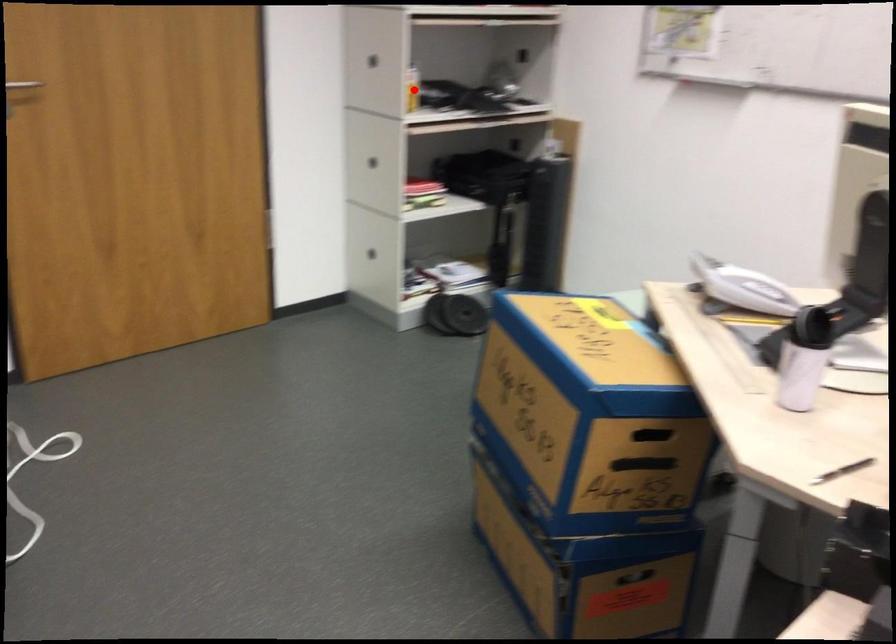
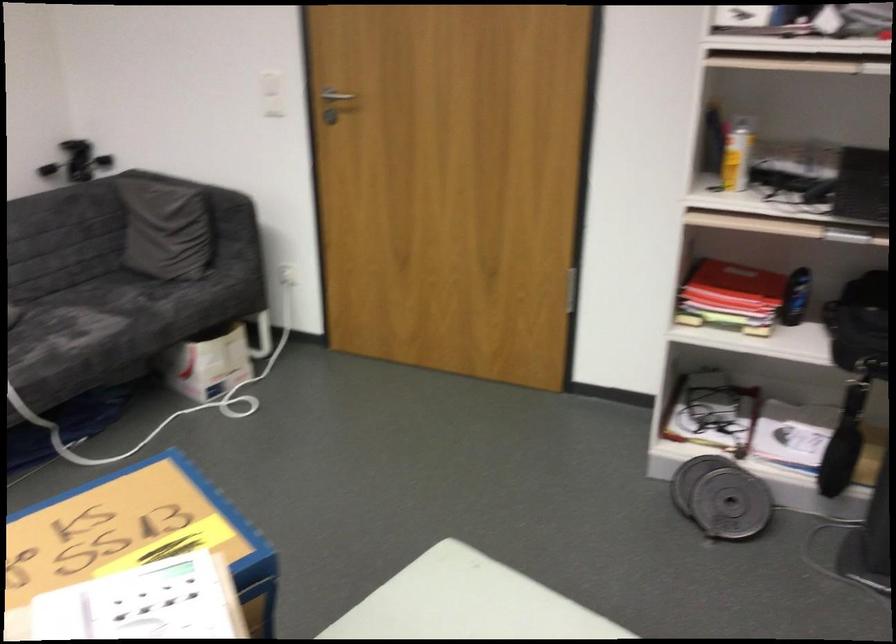
Question: I am providing you with two images of the same scene from different viewpoints. Given a red point in image1, look at the same physical point in image2. Is it:

Choices:
 (A) Closer to the viewpoint
 (B) Farther from the viewpoint

Answer: (A)